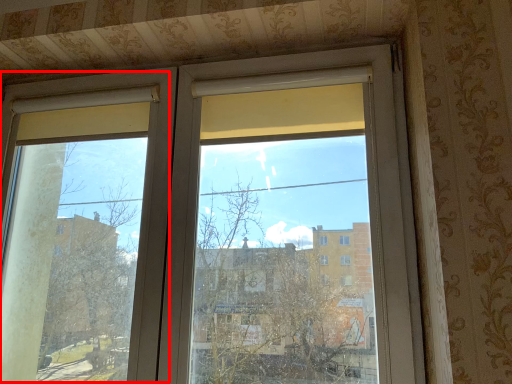
Question: From the image, what is the correct spatial relationship of screen door (annotated by the red box) in relation to window?

Choices:
 (A) left
 (B) right

Answer: (A)